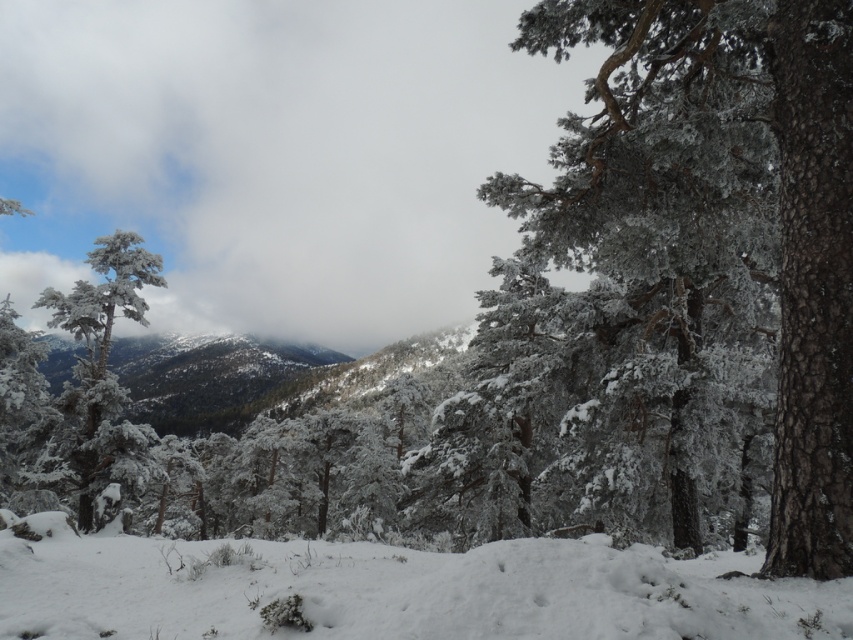
In the scene shown: Does white fluffy cloud at upper center have a smaller size compared to snowy evergreen forest at left?

Actually, white fluffy cloud at upper center might be larger than snowy evergreen forest at left.

Who is positioned more to the right, white fluffy cloud at upper center or snowy evergreen forest at left?

From the viewer's perspective, snowy evergreen forest at left appears more on the right side.

The image size is (853, 640). I want to click on white fluffy cloud at upper center, so click(x=273, y=156).

What do you see at coordinates (102, 378) in the screenshot? This screenshot has width=853, height=640. I see `white frosty tree at left` at bounding box center [102, 378].

Is white frosty tree at left positioned behind snowy evergreen forest at left?

No, it is in front of snowy evergreen forest at left.

Which is in front, point (103, 346) or point (212, 374)?

Point (103, 346)

You are a GUI agent. You are given a task and a screenshot of the screen. Output one action in this format:
    pyautogui.click(x=<x>, y=<y>)
    Task: Click on the white frosty tree at left
    
    Given the screenshot: What is the action you would take?
    102,378

Does white fluffy cloud at upper center come in front of white frosty tree at left?

No.

Is point (47, 170) farther from viewer compared to point (80, 305)?

Yes.

This screenshot has height=640, width=853. I want to click on white fluffy cloud at upper center, so click(273, 156).